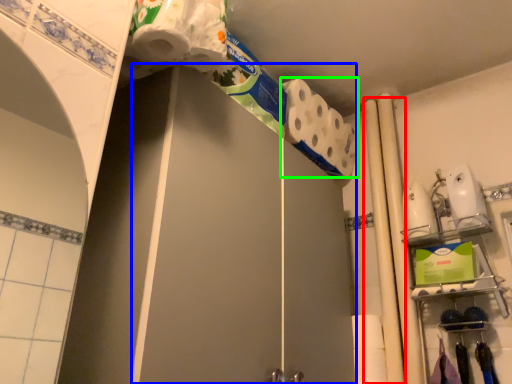
Question: Estimate the real-world distances between objects in this image. Which object is farther from beam (highlighted by a red box), screen door (highlighted by a blue box) or toilet paper (highlighted by a green box)?

Choices:
 (A) screen door
 (B) toilet paper

Answer: (A)